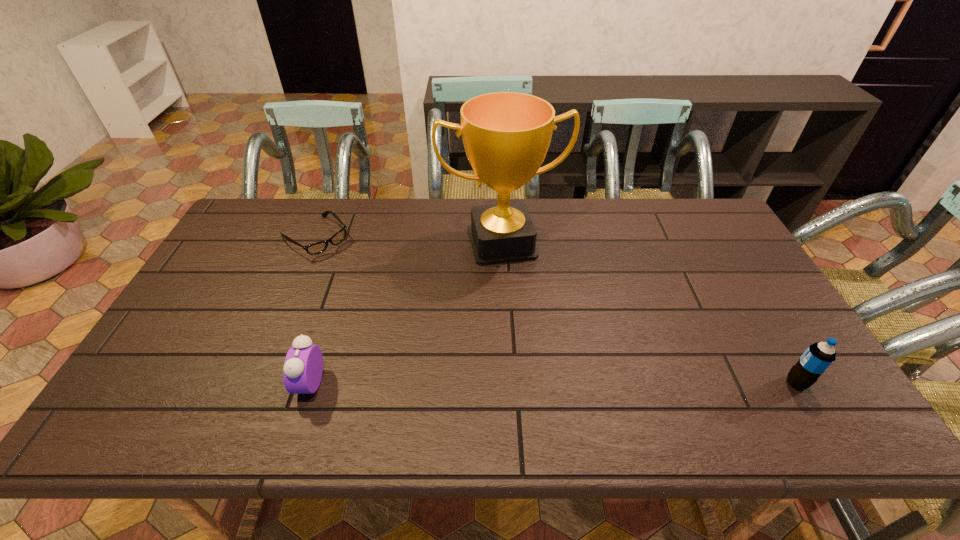
Where is `object that is positioned at the right edge`? The width and height of the screenshot is (960, 540). object that is positioned at the right edge is located at coordinates (818, 357).

The width and height of the screenshot is (960, 540). I want to click on object that is positioned at the near right corner, so click(818, 357).

I want to click on vacant space at the far edge, so click(x=580, y=235).

You are a GUI agent. You are given a task and a screenshot of the screen. Output one action in this format:
    pyautogui.click(x=<x>, y=<y>)
    Task: Click on the blank space at the near edge of the desktop
    
    Given the screenshot: What is the action you would take?
    pyautogui.click(x=281, y=386)

Identify the location of free space at the left edge. The image size is (960, 540). (241, 269).

Image resolution: width=960 pixels, height=540 pixels. Identify the location of vacant space at the near left corner of the desktop. (145, 394).

Locate an element on the screen. Image resolution: width=960 pixels, height=540 pixels. free point at the far right corner is located at coordinates (694, 199).

Find the location of a particular element. Image resolution: width=960 pixels, height=540 pixels. blank region between the tallest object and the third tallest object is located at coordinates (406, 313).

You are a GUI agent. You are given a task and a screenshot of the screen. Output one action in this format:
    pyautogui.click(x=<x>, y=<y>)
    Task: Click on the vacant point located between the rightmost object and the spectacles
    The width and height of the screenshot is (960, 540).
    Given the screenshot: What is the action you would take?
    pyautogui.click(x=556, y=310)

Locate an element on the screen. The width and height of the screenshot is (960, 540). empty space between the second object from right to left and the alarm clock is located at coordinates point(406,313).